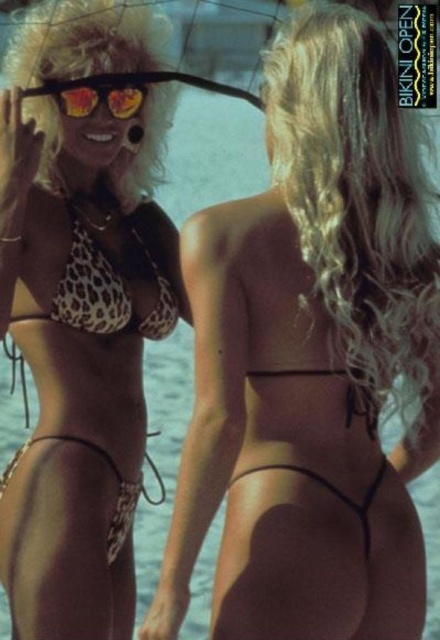
Question: Is matte black bikini bottom at right further to camera compared to leopard print bikini top at upper left?

Choices:
 (A) yes
 (B) no

Answer: (B)

Question: Which object is farther from the camera taking this photo?

Choices:
 (A) leopard print bikini bottom at center
 (B) leopard print bikini at left

Answer: (B)

Question: Which point is closer to the camera taking this photo?

Choices:
 (A) (70, 81)
 (B) (66, 410)

Answer: (B)

Question: Which of the following is the farthest from the observer?

Choices:
 (A) leopard print bikini bottom at center
 (B) matte black bikini bottom at right

Answer: (B)

Question: Can you confirm if matte black bikini bottom at right is smaller than shiny orange sunglasses at upper left?

Choices:
 (A) no
 (B) yes

Answer: (A)

Question: Where is leopard print bikini bottom at center located in relation to matte black bikini bottom at right in the image?

Choices:
 (A) above
 (B) below

Answer: (B)